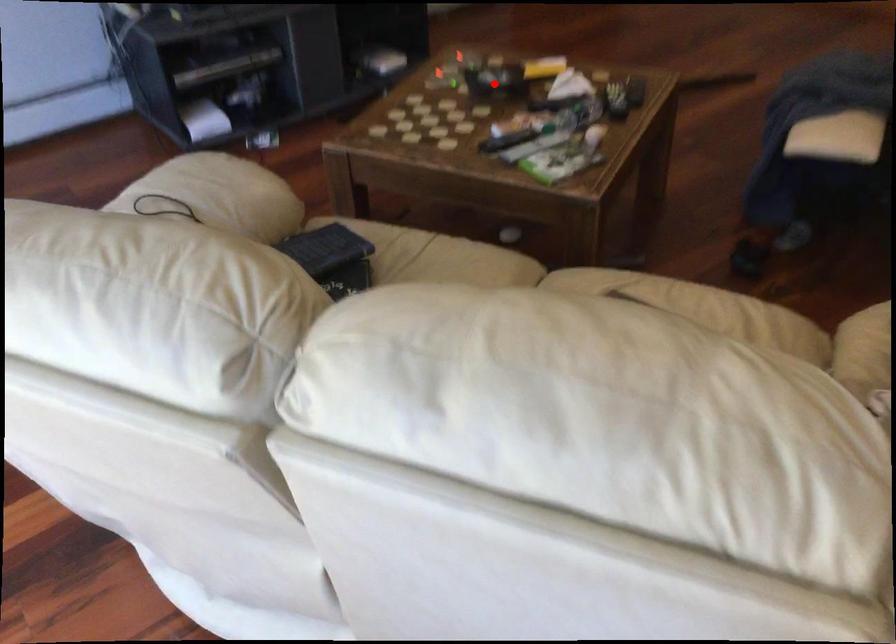
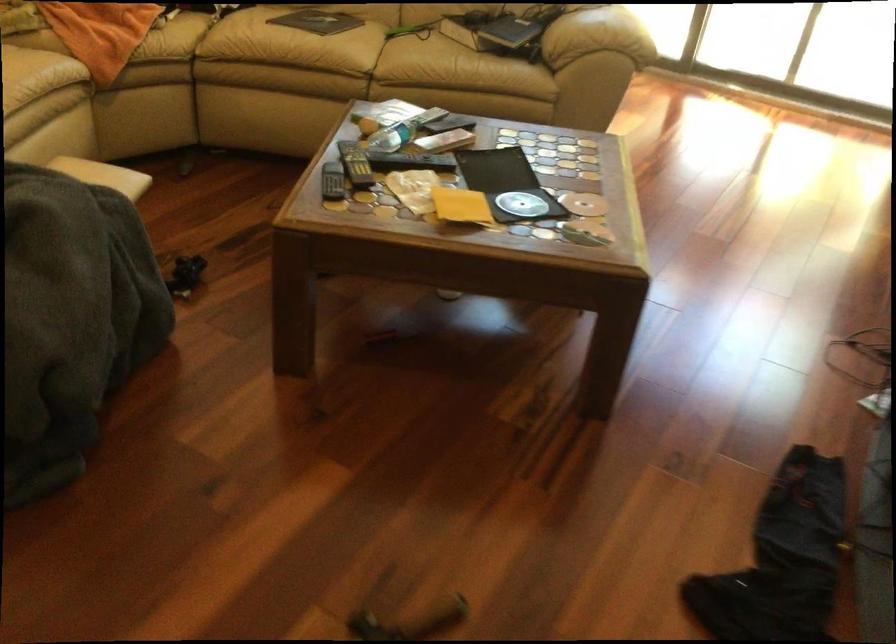
In the second image, find the point that corresponds to the highlighted location in the first image.

(506, 184)